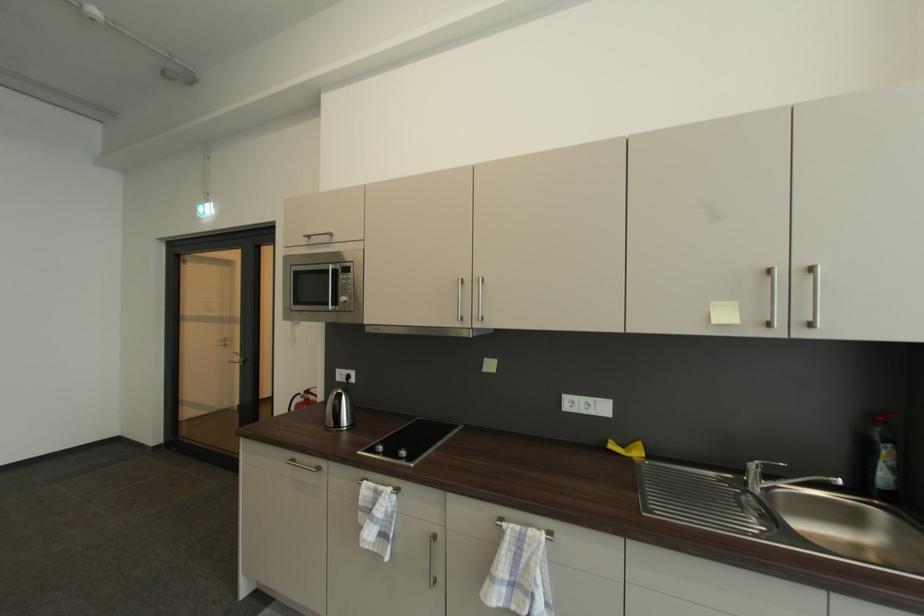
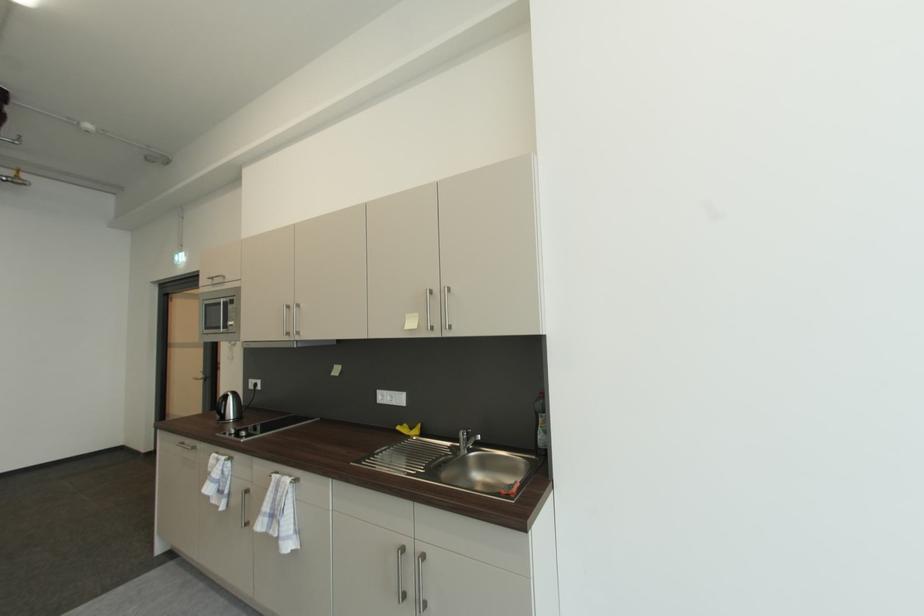
In the second image, find the point that corresponds to pixel 507 529 in the first image.

(277, 477)